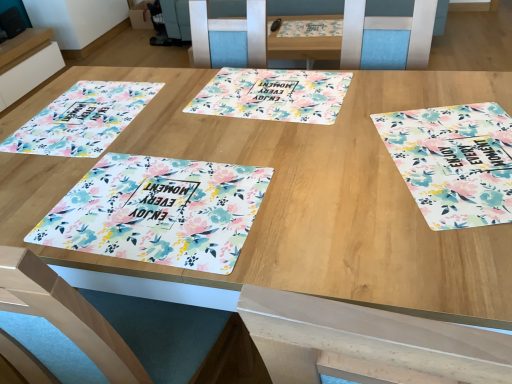
You are a GUI agent. You are given a task and a screenshot of the screen. Output one action in this format:
    pyautogui.click(x=<x>, y=<y>)
    Task: Click on the vacant space that's between floral printed placemat at left, arranged as the 3th tablecloth when viewed from the right, and floral fabric placemat at right, which is the third tablecloth in left-to-right order
    The height and width of the screenshot is (384, 512).
    Given the screenshot: What is the action you would take?
    pyautogui.click(x=259, y=136)